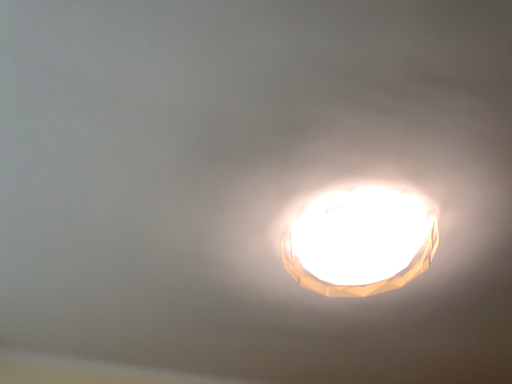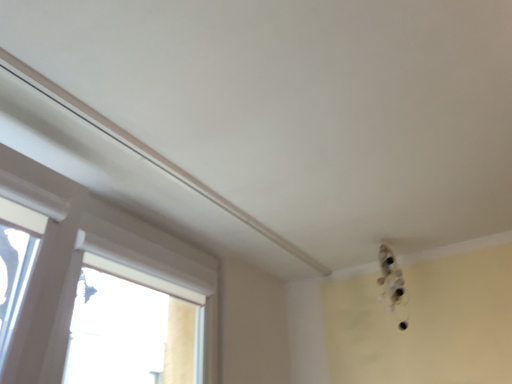
Question: How did the camera likely rotate when shooting the video?

Choices:
 (A) rotated right
 (B) rotated left

Answer: (B)